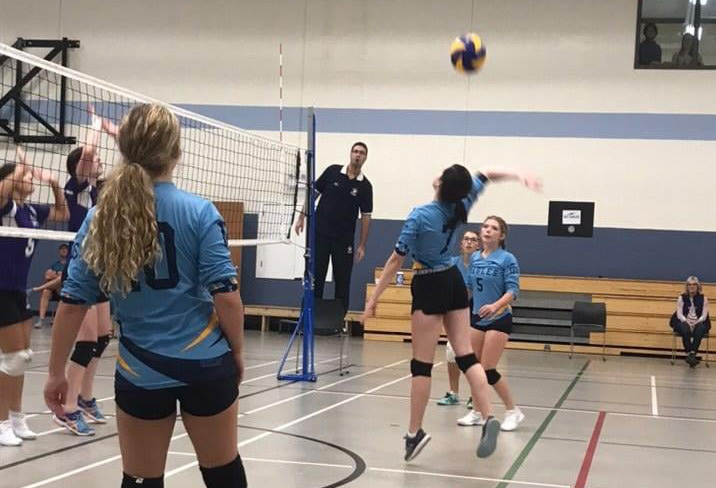
Locate an element on the screen. Image resolution: width=716 pixels, height=488 pixels. wall is located at coordinates (548, 66).